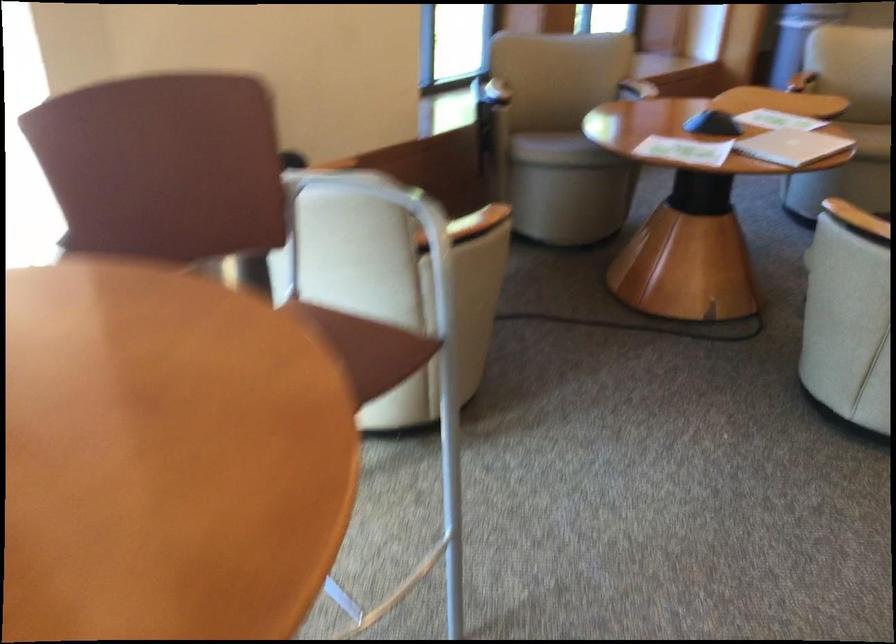
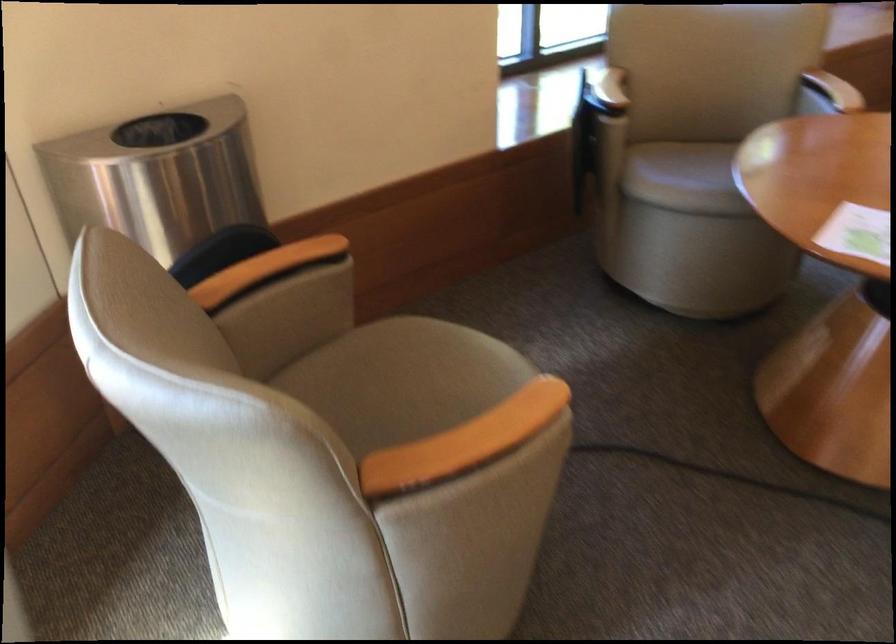
Question: In a continuous first-person perspective shot, in which direction is the camera moving?

Choices:
 (A) Left
 (B) Right
 (C) Forward
 (D) Backward

Answer: (C)